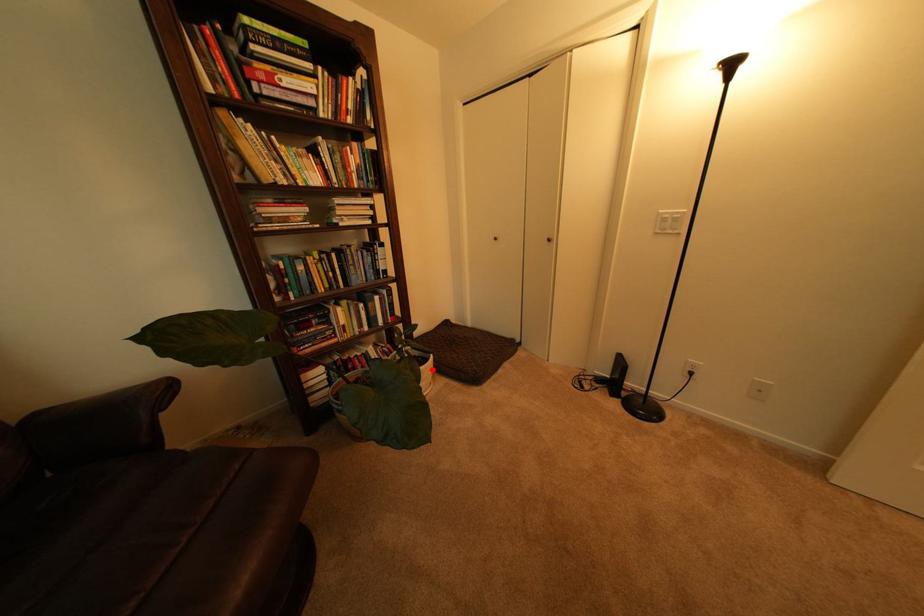
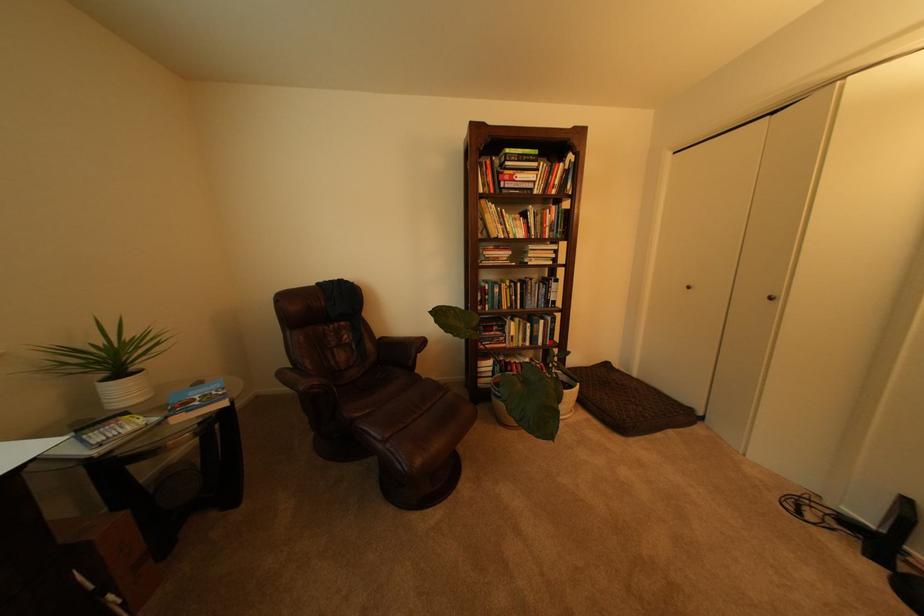
Question: I am providing you with two images of the same scene from different viewpoints. A red point is shown in image1. For the corresponding object point in image2, is it positioned nearer or farther from the camera?

Choices:
 (A) Nearer
 (B) Farther

Answer: (B)